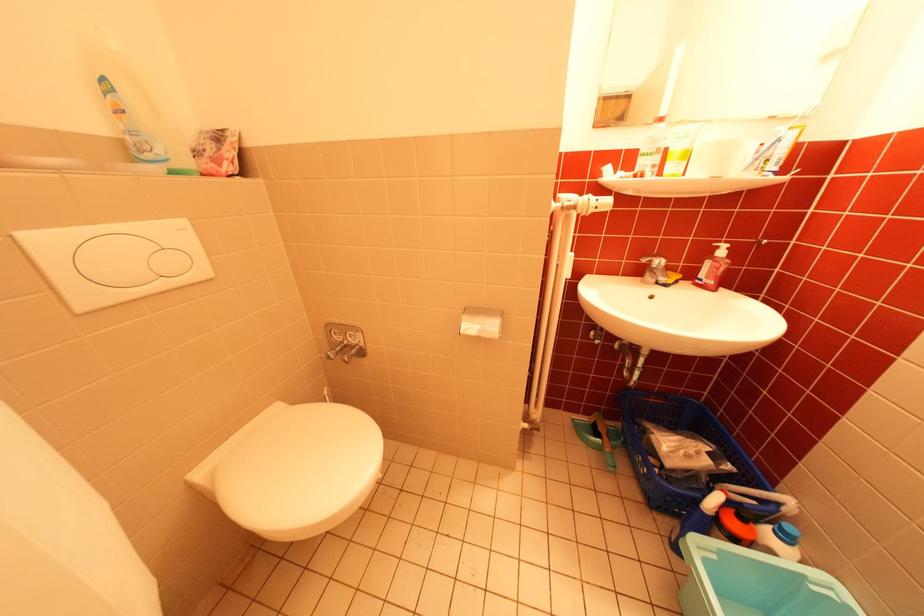
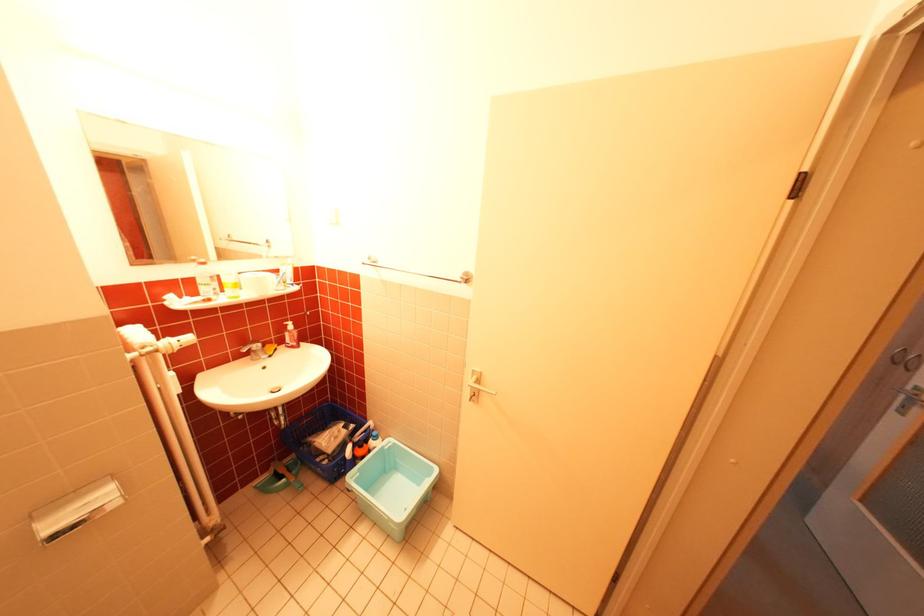
Find the pixel in the second image that matches [606,415] in the first image.

(283, 464)